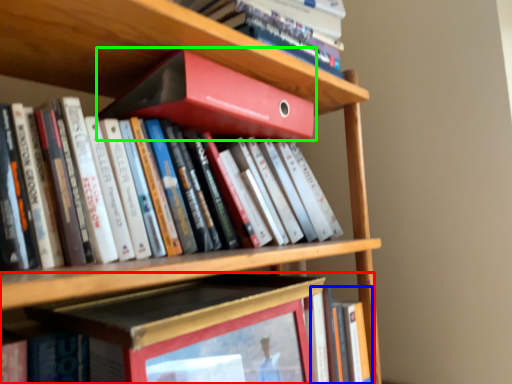
Question: Considering the real-world distances, which object is closest to book (highlighted by a red box)? book (highlighted by a blue box) or book (highlighted by a green box).

Choices:
 (A) book
 (B) book

Answer: (A)